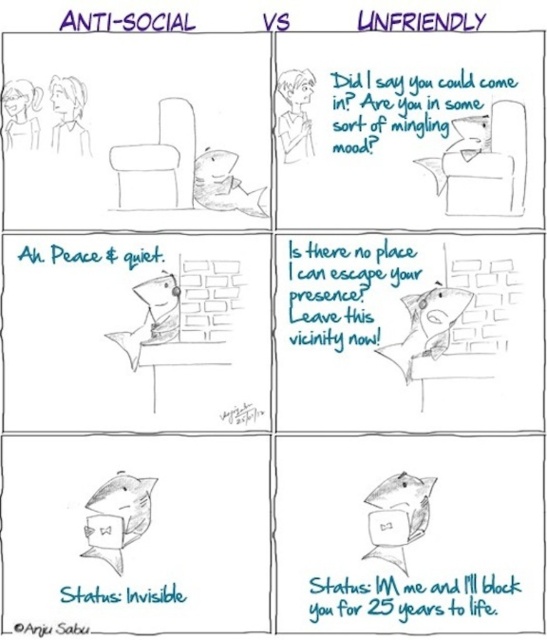
Question: Is black text at lower right to the left of black handwritten text at center from the viewer's perspective?

Choices:
 (A) yes
 (B) no

Answer: (B)

Question: Which of the following is the farthest from the observer?

Choices:
 (A) white paper text at upper center
 (B) black text at lower right
 (C) black handwritten text at center

Answer: (C)

Question: Which point appears farthest from the camera in this image?

Choices:
 (A) (55, 257)
 (B) (138, 17)
 (C) (311, 246)
 (D) (400, 120)

Answer: (C)

Question: From the image, what is the correct spatial relationship of white paper text at upper center in relation to invisible status at lower left?

Choices:
 (A) right
 (B) left

Answer: (A)

Question: Is black text at lower right wider than anti-social text at upper left?

Choices:
 (A) yes
 (B) no

Answer: (A)

Question: Which point is closer to the camera?

Choices:
 (A) (363, 81)
 (B) (115, 29)

Answer: (B)